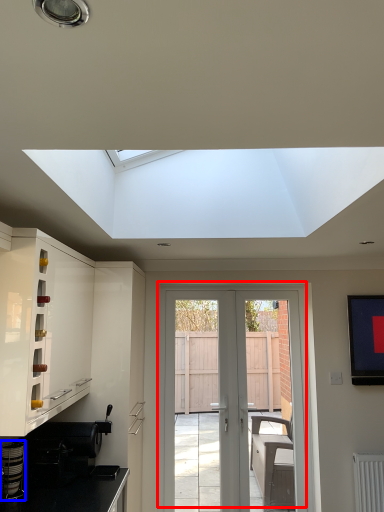
Question: Which object appears farthest to the camera in this image, door (highlighted by a red box) or appliance (highlighted by a blue box)?

Choices:
 (A) door
 (B) appliance

Answer: (A)